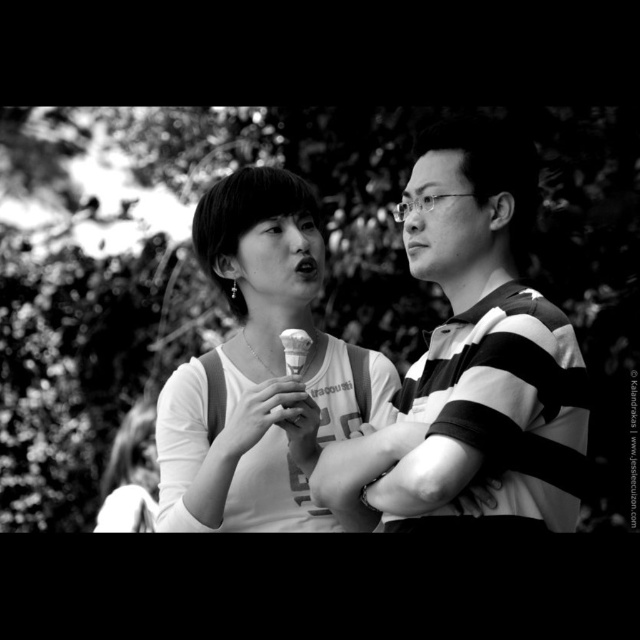
Does point (579, 493) lie in front of point (300, 200)?

That is True.

Is striped fabric shirt at right wider than matte white tank top at center?

No, striped fabric shirt at right is not wider than matte white tank top at center.

Measure the distance between striped fabric shirt at right and camera.

striped fabric shirt at right and camera are 3.71 meters apart from each other.

What are the coordinates of `striped fabric shirt at right` in the screenshot? It's located at click(x=472, y=356).

Looking at this image, is matte white tank top at center closer to camera compared to white paper ice cream cone at center?

No, matte white tank top at center is further to the viewer.

Does matte white tank top at center appear under white paper ice cream cone at center?

No, matte white tank top at center is not below white paper ice cream cone at center.

Between point (268, 172) and point (292, 353), which one is positioned in front?

Positioned in front is point (292, 353).

Locate an element on the screen. The width and height of the screenshot is (640, 640). matte white tank top at center is located at coordinates (260, 371).

Does point (435, 388) come farther from viewer compared to point (285, 349)?

No.

What do you see at coordinates (472, 356) in the screenshot?
I see `striped fabric shirt at right` at bounding box center [472, 356].

Where is `striped fabric shirt at right`? This screenshot has height=640, width=640. striped fabric shirt at right is located at coordinates (472, 356).